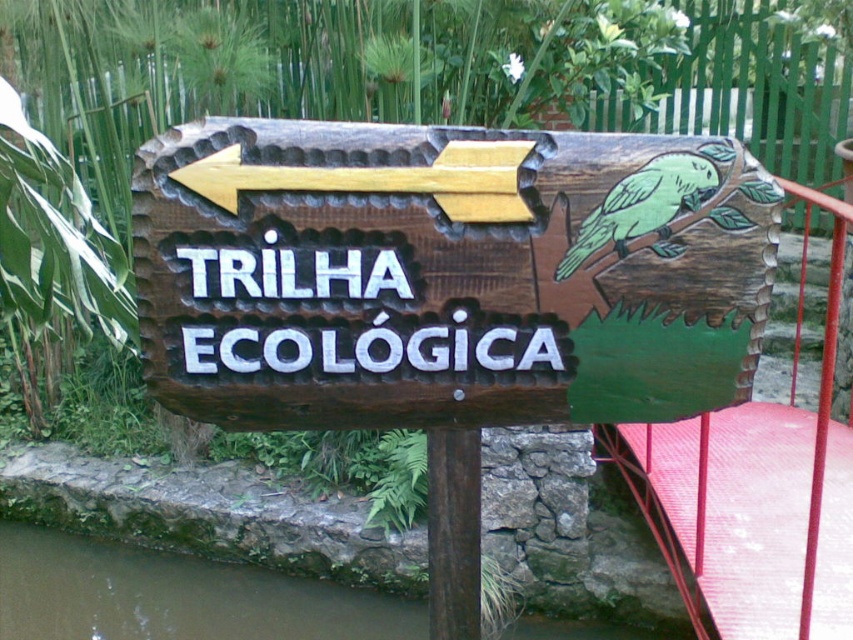
Between point (515, 218) and point (476, 500), which one is positioned behind?

The point (476, 500) is more distant.

At what (x,y) coordinates should I click in order to perform the action: click on wooden at left. Please return your answer as a coordinate pair (x, y). The width and height of the screenshot is (853, 640). Looking at the image, I should click on pos(381,179).

Is red metal railing at right to the left of brown wood pole at center from the viewer's perspective?

No, red metal railing at right is not to the left of brown wood pole at center.

At what (x,y) coordinates should I click in order to perform the action: click on red metal railing at right. Please return your answer as a coordinate pair (x, y). Looking at the image, I should click on (756, 490).

Locate an element on the screen. This screenshot has width=853, height=640. red metal railing at right is located at coordinates (756, 490).

Which is below, wooden sign at center or red metal railing at right?

red metal railing at right is below.

This screenshot has width=853, height=640. Describe the element at coordinates (445, 273) in the screenshot. I see `wooden sign at center` at that location.

The image size is (853, 640). I want to click on wooden sign at center, so click(x=445, y=273).